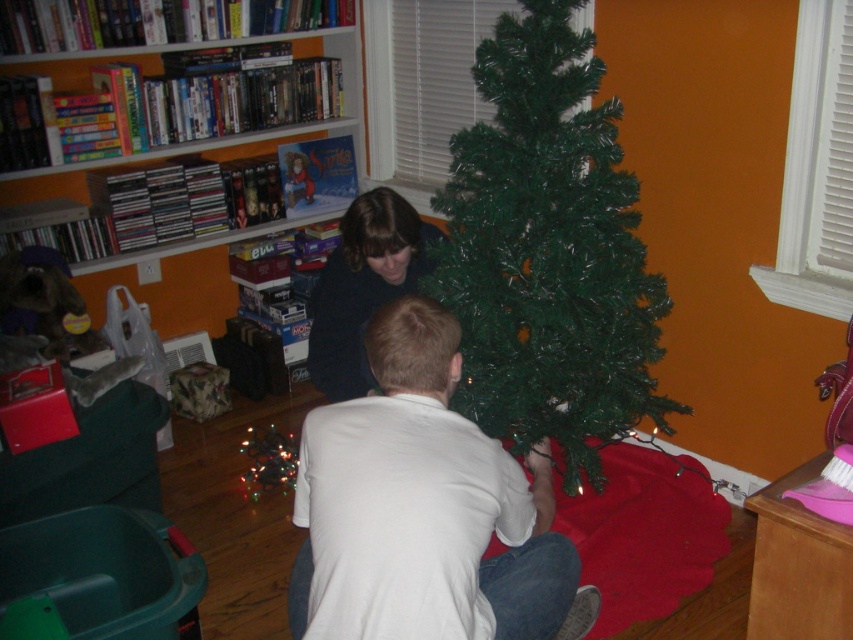
Who is taller, green artificial christmas tree at center or white matte shirt at center?

green artificial christmas tree at center

You are a GUI agent. You are given a task and a screenshot of the screen. Output one action in this format:
    pyautogui.click(x=<x>, y=<y>)
    Task: Click on the green artificial christmas tree at center
    
    Given the screenshot: What is the action you would take?
    pyautogui.click(x=548, y=252)

Does white matte shirt at center appear on the right side of wooden bookshelf at upper left?

Yes, white matte shirt at center is to the right of wooden bookshelf at upper left.

Does white matte shirt at center have a lesser height compared to wooden bookshelf at upper left?

Yes, white matte shirt at center is shorter than wooden bookshelf at upper left.

Is point (361, 630) in front of point (282, 86)?

Yes, it is.

The image size is (853, 640). Find the location of `white matte shirt at center`. white matte shirt at center is located at coordinates (422, 508).

Can you confirm if green artificial christmas tree at center is positioned above wooden bookshelf at upper left?

Incorrect, green artificial christmas tree at center is not positioned above wooden bookshelf at upper left.

This screenshot has width=853, height=640. Find the location of `green artificial christmas tree at center`. green artificial christmas tree at center is located at coordinates (548, 252).

In order to click on green artificial christmas tree at center in this screenshot , I will do `click(548, 252)`.